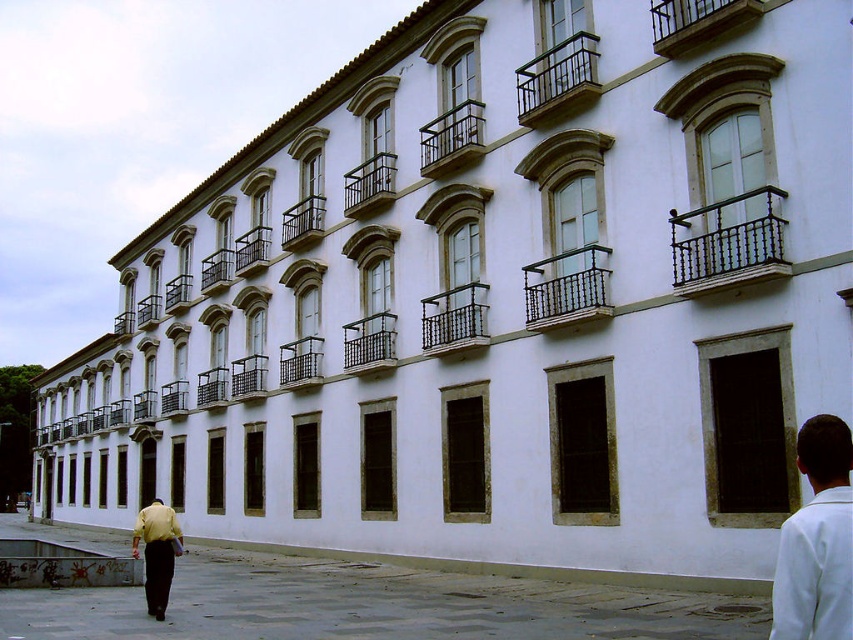
From the picture: Is white matte shirt at lower right smaller than yellow shirt at lower left?

Yes.

Can you confirm if white matte shirt at lower right is shorter than yellow shirt at lower left?

Correct, white matte shirt at lower right is not as tall as yellow shirt at lower left.

Between point (833, 582) and point (152, 554), which one is positioned behind?

Positioned behind is point (152, 554).

This screenshot has width=853, height=640. What are the coordinates of `white matte shirt at lower right` in the screenshot? It's located at (817, 540).